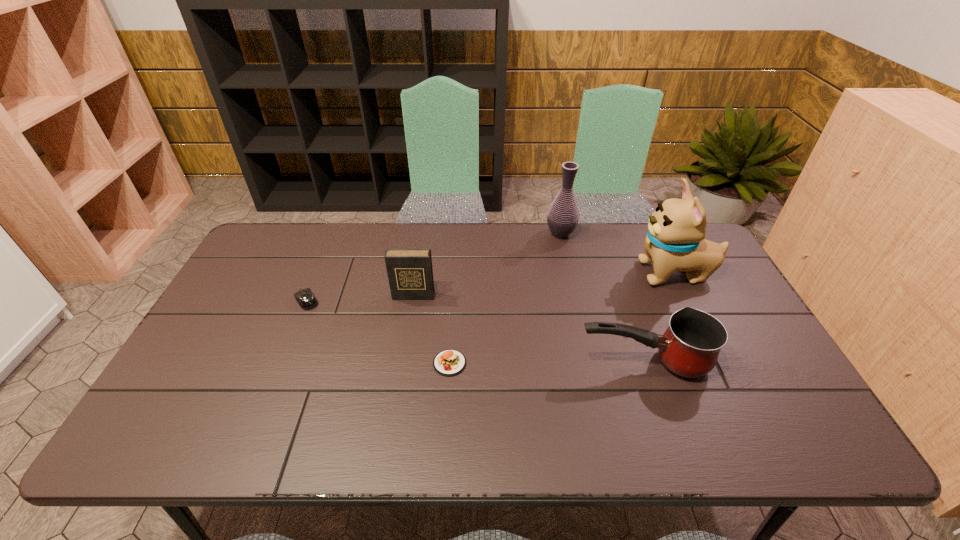
The height and width of the screenshot is (540, 960). What are the coordinates of `vase at the far edge` in the screenshot? It's located at (563, 215).

What are the coordinates of `object that is at the right edge` in the screenshot? It's located at (675, 241).

I want to click on object present at the far right corner, so click(675, 241).

Identify the location of free spot at the far edge of the desktop. (585, 226).

Identify the location of free space at the near edge of the desktop. The height and width of the screenshot is (540, 960). (x=502, y=417).

I want to click on blank area at the left edge, so (x=237, y=352).

Locate an element on the screen. vacant position at the right edge of the desktop is located at coordinates (745, 361).

I want to click on free spot between the vase and the second shortest object, so click(434, 267).

Locate an element on the screen. vacant space that is in between the third object from left to right and the leftmost object is located at coordinates (378, 332).

Identify the location of blank region between the diary and the fifth nearest object. (544, 285).